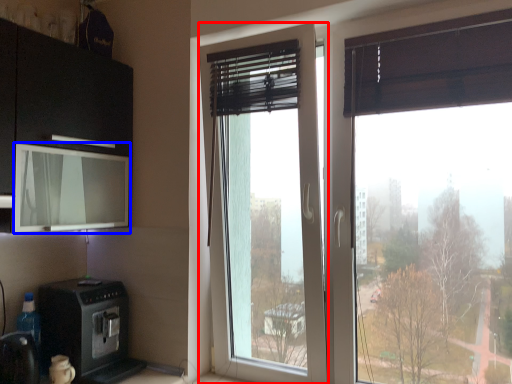
Question: Among these objects, which one is nearest to the camera, window (highlighted by a red box) or window screen (highlighted by a blue box)?

Choices:
 (A) window
 (B) window screen

Answer: (B)